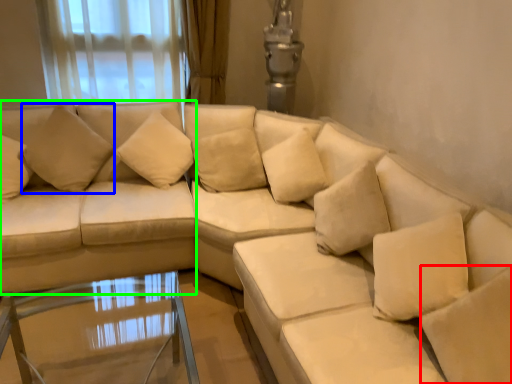
Question: Based on their relative distances, which object is nearer to pillow (highlighted by a red box)? Choose from pillow (highlighted by a blue box) and couch (highlighted by a green box).

Choices:
 (A) pillow
 (B) couch

Answer: (B)